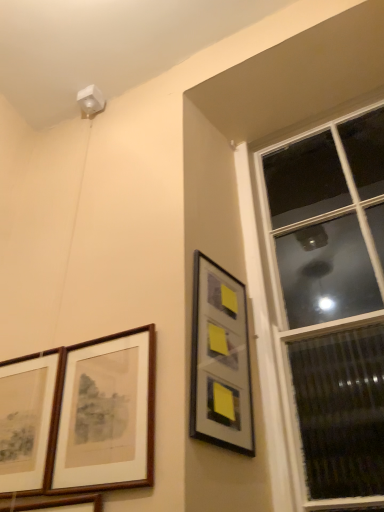
How much space does metallic silver picture frame at upper right, the fourth picture frame from the left, occupy vertically?

21.09 inches.

Locate an element on the screen. wooden framed picture at lower left, placed as the 3th picture frame when sorted from right to left is located at coordinates (52, 503).

This screenshot has height=512, width=384. What are the coordinates of `transparent glass window at upper right` in the screenshot? It's located at (329, 303).

What's the angular difference between transparent glass window at upper right and wooden framed picture at lower left, placed as the 3th picture frame when sorted from right to left,'s facing directions?

They differ by 0.225 degrees in their facing directions.

From the image's perspective, which is below, transparent glass window at upper right or wooden framed picture at lower left, placed as the 3th picture frame when sorted from right to left?

wooden framed picture at lower left, placed as the 3th picture frame when sorted from right to left.

Looking at their sizes, would you say transparent glass window at upper right is wider or thinner than wooden framed picture at lower left, the second picture frame positioned from the left?

transparent glass window at upper right is wider than wooden framed picture at lower left, the second picture frame positioned from the left.

This screenshot has width=384, height=512. What are the coordinates of `the 3rd picture frame below when counting from the metallic silver picture frame at upper right, the 1th picture frame in the right-to-left sequence (from the image's perspective)` in the screenshot? It's located at (52, 503).

Considering the sizes of objects metallic silver picture frame at upper right, the fourth picture frame from the left, and wooden framed picture at lower left, placed as the 3th picture frame when sorted from right to left, in the image provided, who is taller, metallic silver picture frame at upper right, the fourth picture frame from the left, or wooden framed picture at lower left, placed as the 3th picture frame when sorted from right to left,?

metallic silver picture frame at upper right, the fourth picture frame from the left, is taller.

Considering the positions of point (28, 367) and point (69, 477), is point (28, 367) closer or farther from the camera than point (69, 477)?

Point (28, 367) is positioned farther from the camera compared to point (69, 477).

Is wooden picture frame at lower left, the fourth picture frame when ordered from right to left, not within brown wooden picture frame at lower left, the third picture frame in the left-to-right sequence?

wooden picture frame at lower left, the fourth picture frame when ordered from right to left, lies outside brown wooden picture frame at lower left, the third picture frame in the left-to-right sequence,'s area.

Between wooden picture frame at lower left, the fourth picture frame when ordered from right to left, and brown wooden picture frame at lower left, the second picture frame positioned from the right, which one appears on the left side from the viewer's perspective?

wooden picture frame at lower left, the fourth picture frame when ordered from right to left, is more to the left.

Is point (63, 502) closer to viewer compared to point (274, 278)?

Yes, point (63, 502) is in front of point (274, 278).

From the image's perspective, starting from the transparent glass window at upper right, which picture frame is the 4th one below? Please provide its 2D coordinates.

[(52, 503)]

Is wooden framed picture at lower left, the second picture frame positioned from the left, at the right side of transparent glass window at upper right?

Incorrect, wooden framed picture at lower left, the second picture frame positioned from the left, is not on the right side of transparent glass window at upper right.

How different are the orientations of wooden framed picture at lower left, the second picture frame positioned from the left, and transparent glass window at upper right in degrees?

0.225 degrees.

Find the location of a particular element. The width and height of the screenshot is (384, 512). picture frame that is the 1st one when counting leftward from the transparent glass window at upper right is located at coordinates pyautogui.click(x=220, y=360).

Is transparent glass window at upper right further to the viewer compared to metallic silver picture frame at upper right, the 1th picture frame in the right-to-left sequence?

No.

Is metallic silver picture frame at upper right, the 1th picture frame in the right-to-left sequence, not close to transparent glass window at upper right?

metallic silver picture frame at upper right, the 1th picture frame in the right-to-left sequence, is near transparent glass window at upper right, not far away.

Considering the sizes of objects metallic silver picture frame at upper right, the fourth picture frame from the left, and transparent glass window at upper right in the image provided, who is shorter, metallic silver picture frame at upper right, the fourth picture frame from the left, or transparent glass window at upper right?

Standing shorter between the two is metallic silver picture frame at upper right, the fourth picture frame from the left.

Considering the positions of objects metallic silver picture frame at upper right, the fourth picture frame from the left, and transparent glass window at upper right in the image provided, who is more to the right, metallic silver picture frame at upper right, the fourth picture frame from the left, or transparent glass window at upper right?

transparent glass window at upper right.

Is metallic silver picture frame at upper right, the fourth picture frame from the left, in front of or behind transparent glass window at upper right in the image?

Visually, metallic silver picture frame at upper right, the fourth picture frame from the left, is located behind transparent glass window at upper right.

Relative to wooden picture frame at lower left, which appears as the 1th picture frame when viewed from the left, is transparent glass window at upper right in front or behind?

Visually, transparent glass window at upper right is located in front of wooden picture frame at lower left, which appears as the 1th picture frame when viewed from the left.

Which point is more forward, (353,378) or (28,467)?

The point (28,467) is closer to the camera.

Is transparent glass window at upper right facing towards wooden picture frame at lower left, the fourth picture frame when ordered from right to left?

No, transparent glass window at upper right does not turn towards wooden picture frame at lower left, the fourth picture frame when ordered from right to left.

Could you measure the distance between transparent glass window at upper right and wooden picture frame at lower left, which appears as the 1th picture frame when viewed from the left?

They are 83.05 centimeters apart.

Where is `window located above the wooden framed picture at lower left, placed as the 3th picture frame when sorted from right to left (from a real-world perspective)`? window located above the wooden framed picture at lower left, placed as the 3th picture frame when sorted from right to left (from a real-world perspective) is located at coordinates (329, 303).

Which picture frame is the 2nd one when counting from the right side of the wooden framed picture at lower left, the second picture frame positioned from the left? Please provide its 2D coordinates.

[(220, 360)]

When comparing their distances from wooden framed picture at lower left, placed as the 3th picture frame when sorted from right to left, does brown wooden picture frame at lower left, the third picture frame in the left-to-right sequence, or transparent glass window at upper right seem closer?

Based on the image, brown wooden picture frame at lower left, the third picture frame in the left-to-right sequence, appears to be nearer to wooden framed picture at lower left, placed as the 3th picture frame when sorted from right to left.

Based on their spatial positions, is metallic silver picture frame at upper right, the fourth picture frame from the left, or brown wooden picture frame at lower left, the third picture frame in the left-to-right sequence, closer to wooden picture frame at lower left, the fourth picture frame when ordered from right to left?

brown wooden picture frame at lower left, the third picture frame in the left-to-right sequence, is closer to wooden picture frame at lower left, the fourth picture frame when ordered from right to left.

Which object lies further to the anchor point metallic silver picture frame at upper right, the 1th picture frame in the right-to-left sequence, brown wooden picture frame at lower left, the second picture frame positioned from the right, or wooden framed picture at lower left, the second picture frame positioned from the left?

wooden framed picture at lower left, the second picture frame positioned from the left.

Based on the photo, from the image, which object appears to be farther from metallic silver picture frame at upper right, the 1th picture frame in the right-to-left sequence, wooden framed picture at lower left, the second picture frame positioned from the left, or transparent glass window at upper right?

wooden framed picture at lower left, the second picture frame positioned from the left.

Which object lies further to the anchor point metallic silver picture frame at upper right, the 1th picture frame in the right-to-left sequence, wooden picture frame at lower left, the fourth picture frame when ordered from right to left, or wooden framed picture at lower left, the second picture frame positioned from the left?

wooden picture frame at lower left, the fourth picture frame when ordered from right to left, is further to metallic silver picture frame at upper right, the 1th picture frame in the right-to-left sequence.

Which object lies nearer to the anchor point wooden picture frame at lower left, which appears as the 1th picture frame when viewed from the left, wooden framed picture at lower left, placed as the 3th picture frame when sorted from right to left, or metallic silver picture frame at upper right, the 1th picture frame in the right-to-left sequence?

Based on the image, wooden framed picture at lower left, placed as the 3th picture frame when sorted from right to left, appears to be nearer to wooden picture frame at lower left, which appears as the 1th picture frame when viewed from the left.

Based on their spatial positions, is transparent glass window at upper right or wooden picture frame at lower left, the fourth picture frame when ordered from right to left, closer to brown wooden picture frame at lower left, the second picture frame positioned from the right?

wooden picture frame at lower left, the fourth picture frame when ordered from right to left, is positioned closer to the anchor brown wooden picture frame at lower left, the second picture frame positioned from the right.

Looking at the image, which one is located closer to metallic silver picture frame at upper right, the 1th picture frame in the right-to-left sequence, wooden framed picture at lower left, placed as the 3th picture frame when sorted from right to left, or wooden picture frame at lower left, which appears as the 1th picture frame when viewed from the left?

wooden framed picture at lower left, placed as the 3th picture frame when sorted from right to left, is positioned closer to the anchor metallic silver picture frame at upper right, the 1th picture frame in the right-to-left sequence.

This screenshot has height=512, width=384. I want to click on picture frame between brown wooden picture frame at lower left, the second picture frame positioned from the right, and transparent glass window at upper right from left to right, so click(x=220, y=360).

Image resolution: width=384 pixels, height=512 pixels. I want to click on picture frame that lies between brown wooden picture frame at lower left, the third picture frame in the left-to-right sequence, and wooden framed picture at lower left, placed as the 3th picture frame when sorted from right to left, from top to bottom, so click(26, 420).